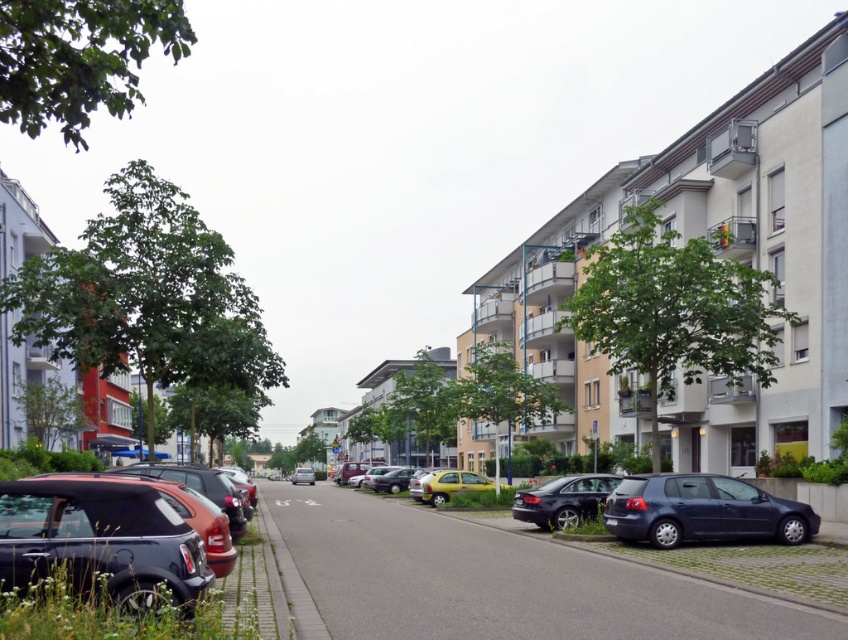
Consider the image. Is the position of shiny black sedan at center less distant than that of silver metallic car at center?

Yes, it is in front of silver metallic car at center.

What do you see at coordinates (562, 500) in the screenshot? The width and height of the screenshot is (848, 640). I see `shiny black sedan at center` at bounding box center [562, 500].

Locate an element on the screen. The height and width of the screenshot is (640, 848). shiny black sedan at center is located at coordinates (562, 500).

Does shiny black sedan at center have a smaller size compared to yellow matte car at center?

Yes, shiny black sedan at center is smaller than yellow matte car at center.

Is shiny black sedan at center shorter than yellow matte car at center?

Correct, shiny black sedan at center is not as tall as yellow matte car at center.

Where is `shiny black sedan at center`? The image size is (848, 640). shiny black sedan at center is located at coordinates (562, 500).

From the picture: Which of these two, shiny black car at lower left or yellow matte car at center, stands shorter?

shiny black car at lower left is shorter.

Does point (155, 563) come farther from viewer compared to point (430, 483)?

No, it is in front of (430, 483).

The height and width of the screenshot is (640, 848). What do you see at coordinates (116, 540) in the screenshot?
I see `shiny black car at lower left` at bounding box center [116, 540].

Identify the location of shiny black car at lower left. (116, 540).